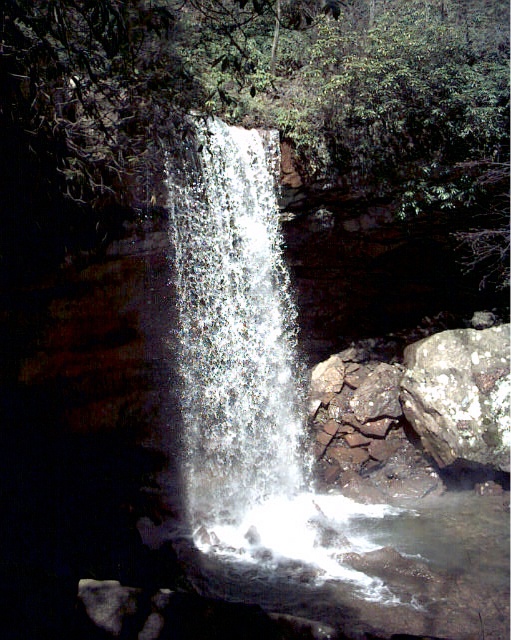
Is clear water at center shorter than white speckled rock at center-right?

Yes, clear water at center is shorter than white speckled rock at center-right.

At what (x,y) coordinates should I click in order to perform the action: click on clear water at center. Please return your answer as a coordinate pair (x, y). The width and height of the screenshot is (511, 640). Looking at the image, I should click on (234, 337).

Where is `clear water at center`? clear water at center is located at coordinates (234, 337).